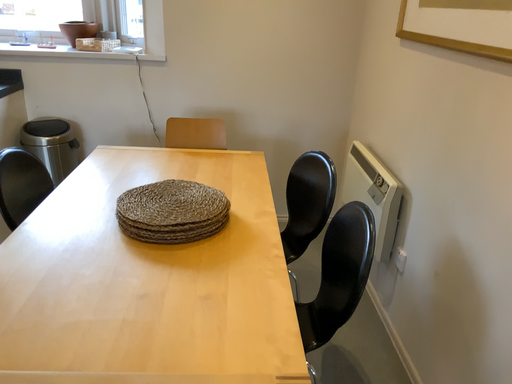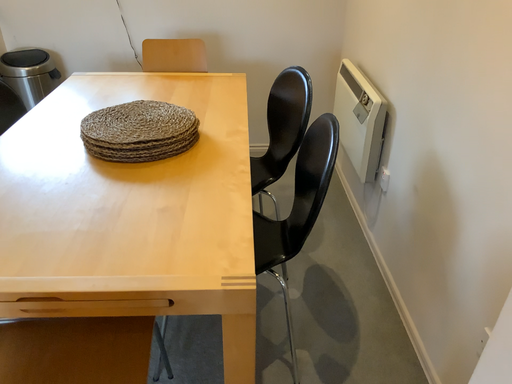
Question: How did the camera likely rotate when shooting the video?

Choices:
 (A) rotated upward
 (B) rotated downward

Answer: (B)